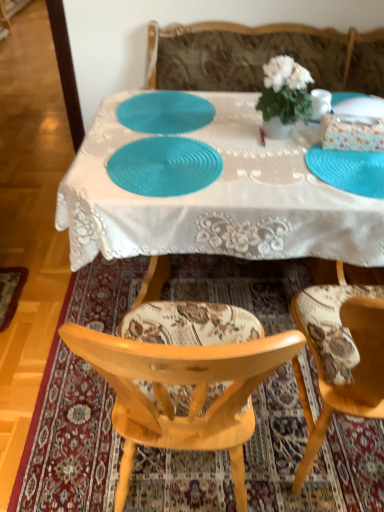
This screenshot has width=384, height=512. I want to click on vacant space behind teal textured plate at center, acting as the 2th plate starting from the left, so click(x=182, y=124).